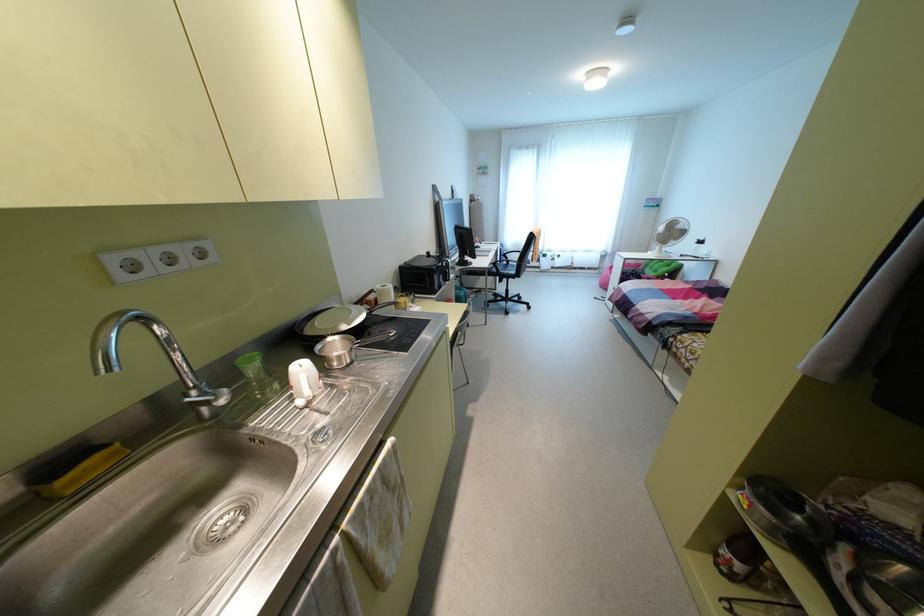
Find where to lift the saucepan handle. Please return your answer as a coordinate pair (x, y).

(393, 342)